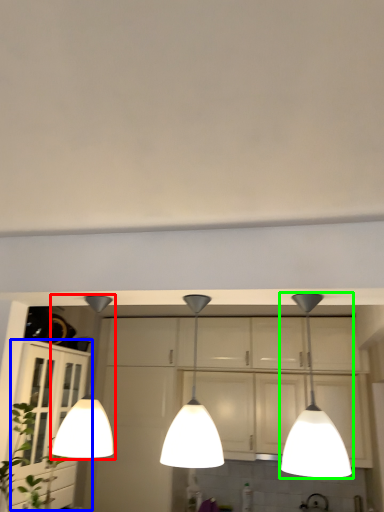
Question: Which object is the farthest from lamp (highlighted by a red box)? Choose among these: cabinetry (highlighted by a blue box) or lamp (highlighted by a green box).

Choices:
 (A) cabinetry
 (B) lamp

Answer: (B)